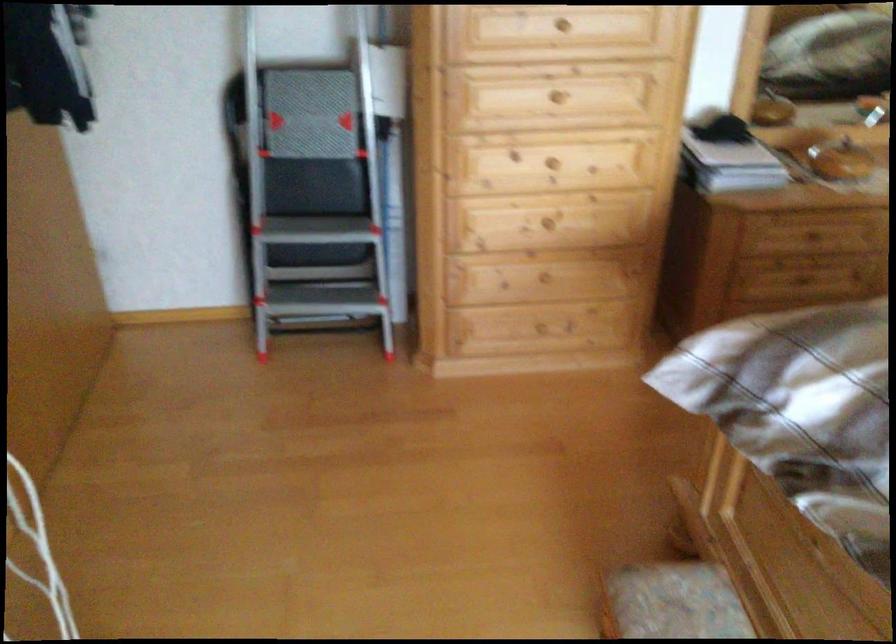
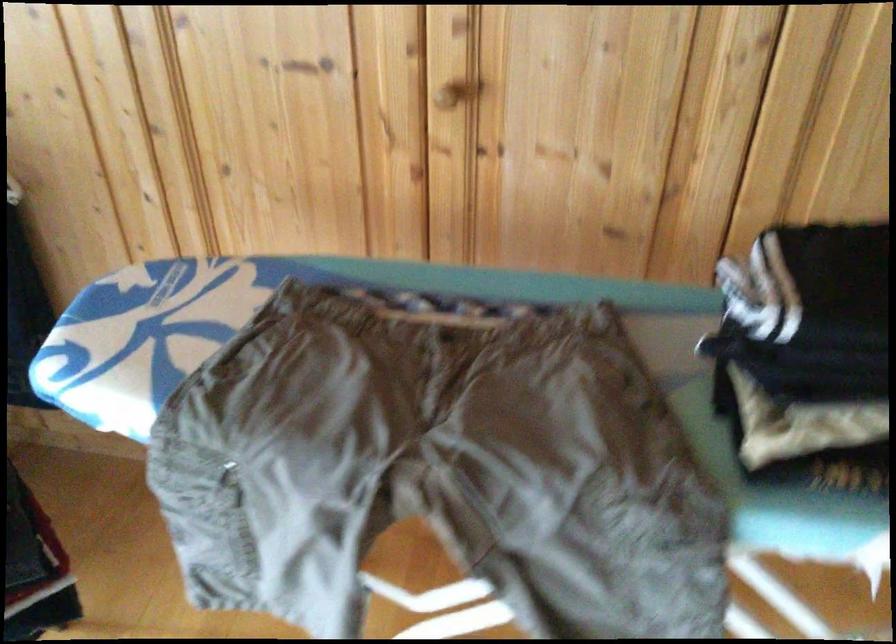
The images are taken continuously from a first-person perspective. In which direction is your viewpoint rotating?

The camera rotated toward left-down.